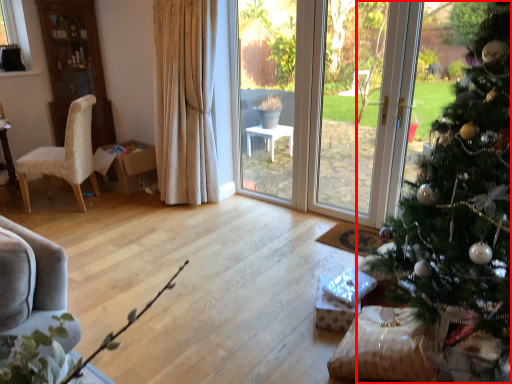
Question: From the image's perspective, where is christmas tree (annotated by the red box) located relative to chair?

Choices:
 (A) below
 (B) above

Answer: (A)